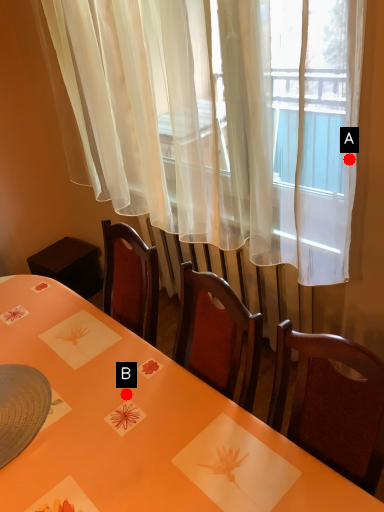
Question: Two points are circled on the image, labeled by A and B beside each circle. Which point is closer to the camera taking this photo?

Choices:
 (A) A is closer
 (B) B is closer

Answer: (B)